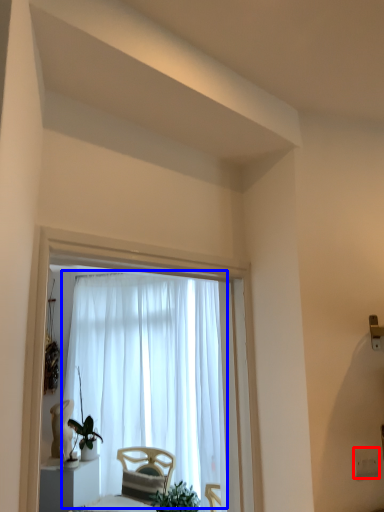
Question: Among these objects, which one is farthest to the camera, electric outlet (highlighted by a red box) or curtain (highlighted by a blue box)?

Choices:
 (A) electric outlet
 (B) curtain

Answer: (B)